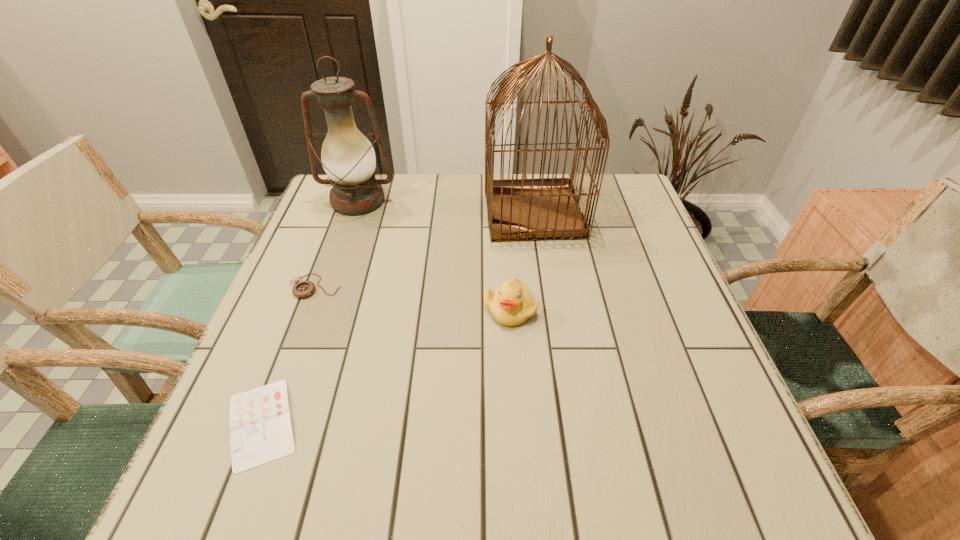
You are a GUI agent. You are given a task and a screenshot of the screen. Output one action in this format:
    pyautogui.click(x=<x>, y=<y>)
    Task: Click on the vacant region between the second shortest object and the birdcage
    Image resolution: width=960 pixels, height=540 pixels.
    Given the screenshot: What is the action you would take?
    pyautogui.click(x=424, y=249)

Locate an element on the screen. vacant area that lies between the birdcage and the third tallest object is located at coordinates (522, 260).

Find the location of a particular element. The height and width of the screenshot is (540, 960). vacant area between the third tallest object and the birdcage is located at coordinates (522, 260).

Find the location of a particular element. This screenshot has width=960, height=540. blank region between the third shortest object and the nearest object is located at coordinates (386, 366).

Locate an element on the screen. vacant space that is in between the oil lamp and the third shortest object is located at coordinates (434, 255).

Select which object appears as the fourth closest to the diary. Please provide its 2D coordinates. Your answer should be formatted as a tuple, i.e. [(x, y)], where the tuple contains the x and y coordinates of a point satisfying the conditions above.

[(523, 209)]

Choose which object is the nearest neighbor to the duckling. Please provide its 2D coordinates. Your answer should be formatted as a tuple, i.e. [(x, y)], where the tuple contains the x and y coordinates of a point satisfying the conditions above.

[(523, 209)]

This screenshot has width=960, height=540. I want to click on vacant point that satisfies the following two spatial constraints: 1. on the back side of the pocket watch; 2. on the right side of the birdcage, so click(x=344, y=212).